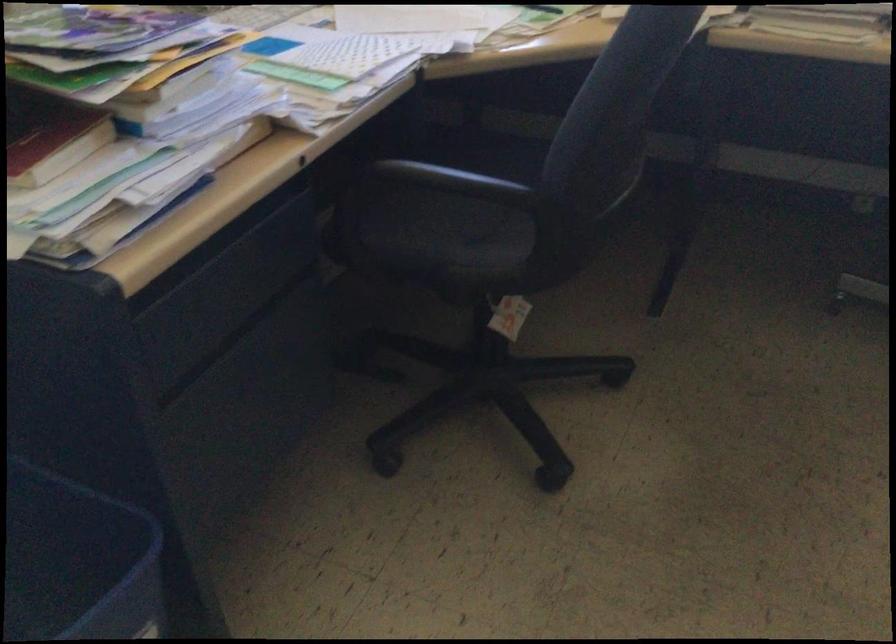
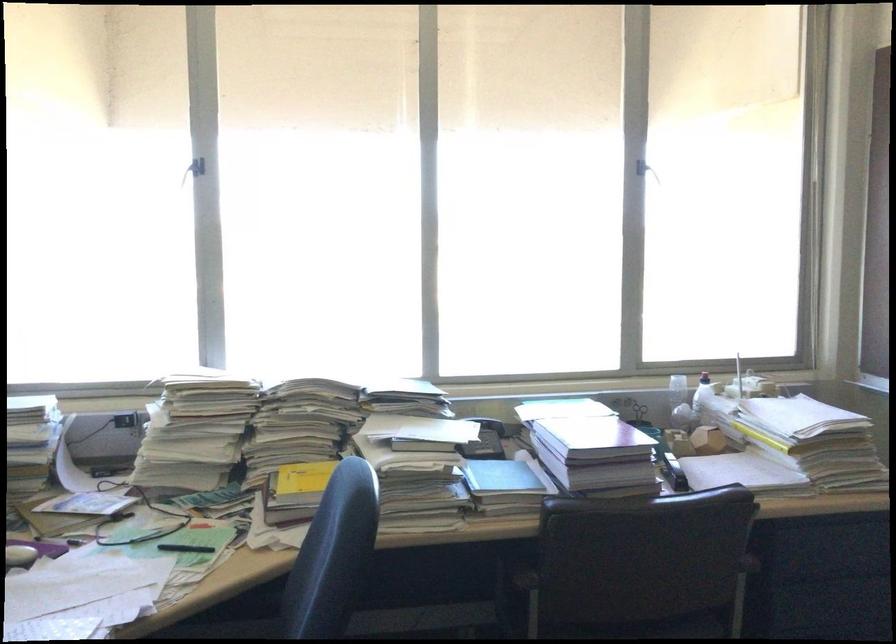
The first image is from the beginning of the video and the second image is from the end. How did the camera likely rotate when shooting the video?

The rotation direction of the camera is right-up.